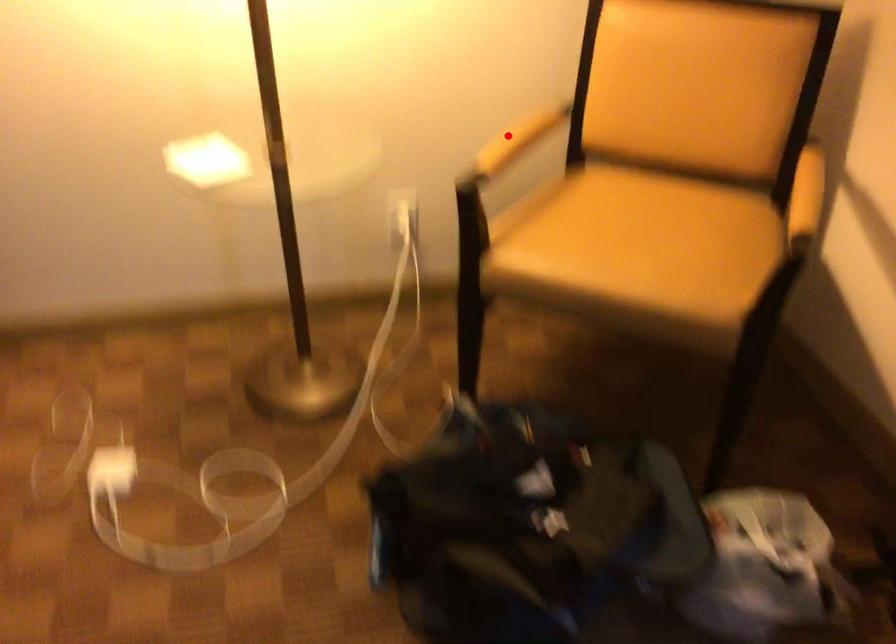
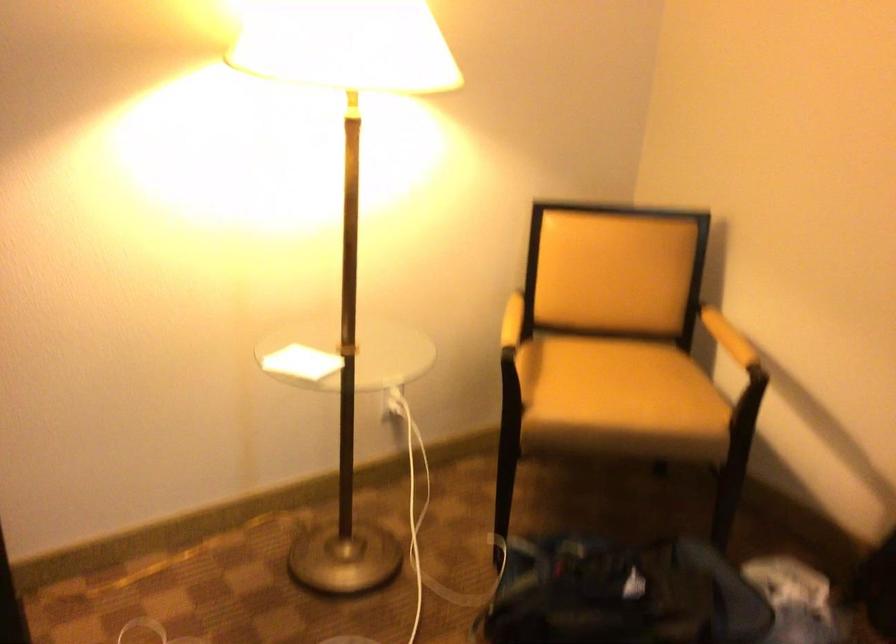
Locate, in the second image, the point that corresponds to the highlighted location in the first image.

(512, 321)